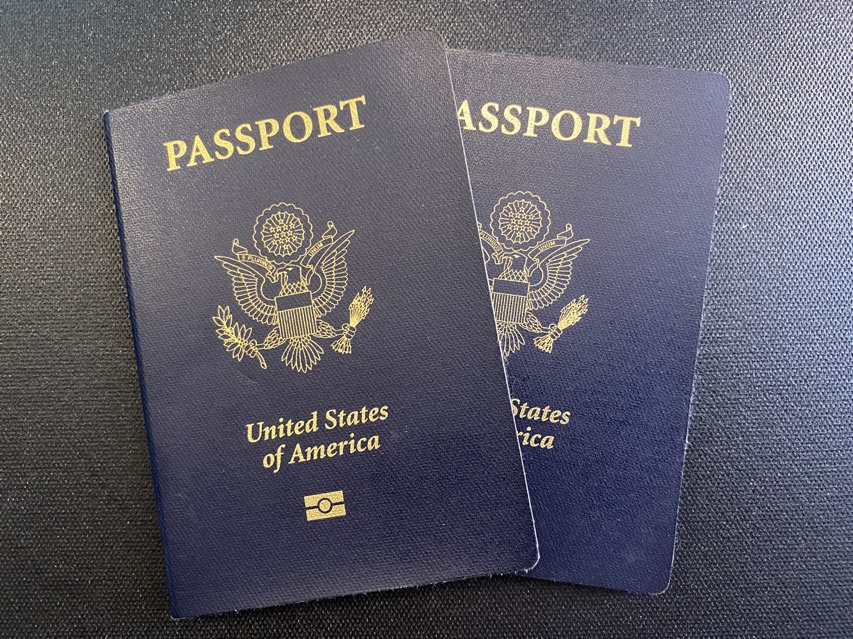
You are a GUI agent. You are given a task and a screenshot of the screen. Output one action in this format:
    pyautogui.click(x=<x>, y=<y>)
    Task: Click on the surface
    The image size is (853, 639).
    Given the screenshot: What is the action you would take?
    pyautogui.click(x=769, y=314)